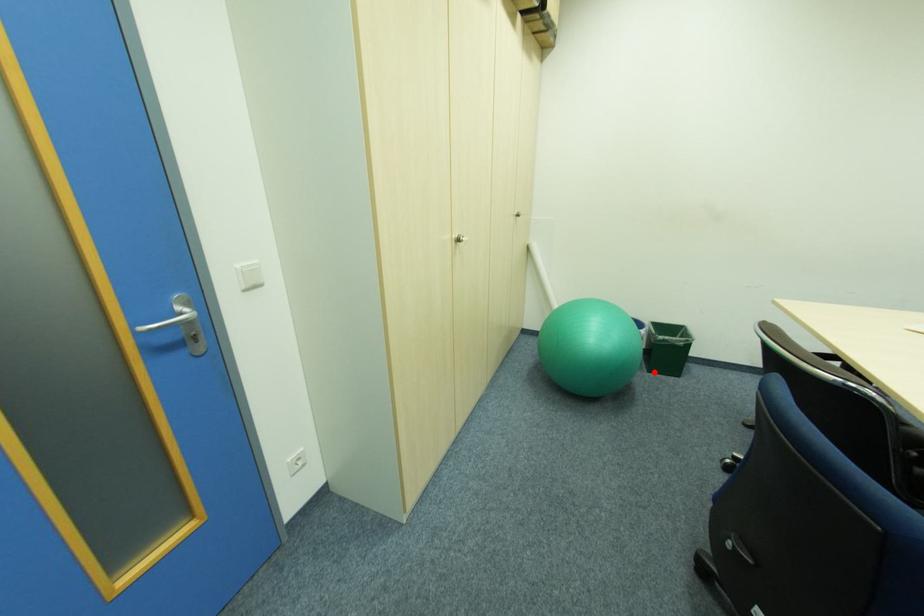
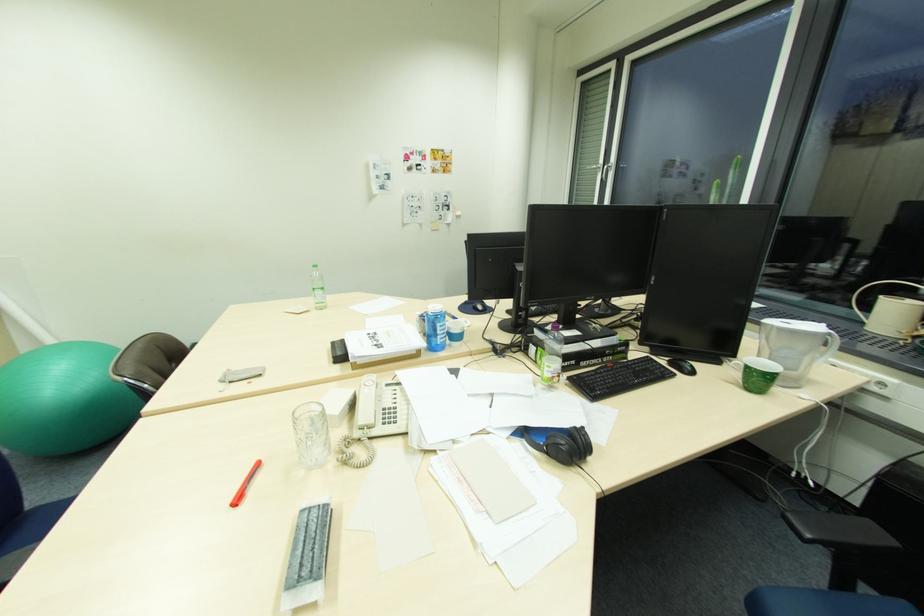
Question: I am providing you with two images of the same scene from different viewpoints. A red point is marked on the first image. At the location where the point appears in image 1, is it still visible in image 2?

Choices:
 (A) Yes
 (B) No

Answer: (B)